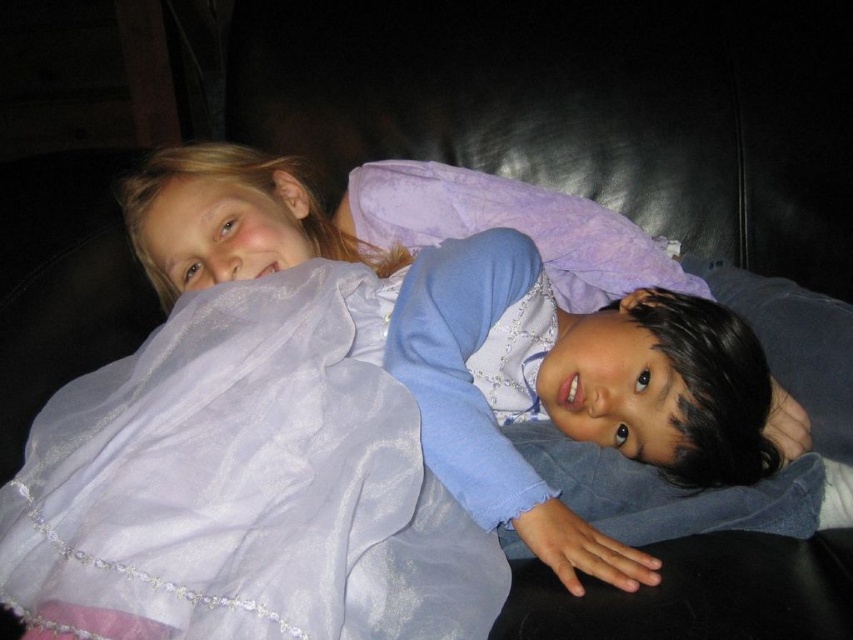
Is point (379, 230) positioned after point (450, 637)?

Yes, it is behind point (450, 637).

Describe the element at coordinates (518, 346) in the screenshot. I see `matte purple dress at center` at that location.

Locate an element on the screen. Image resolution: width=853 pixels, height=640 pixels. matte purple dress at center is located at coordinates (518, 346).